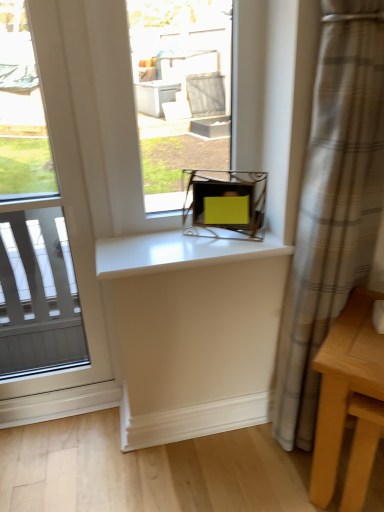
This screenshot has height=512, width=384. In order to click on vacant space to the left of yellow matte box at center in this screenshot , I will do `click(172, 238)`.